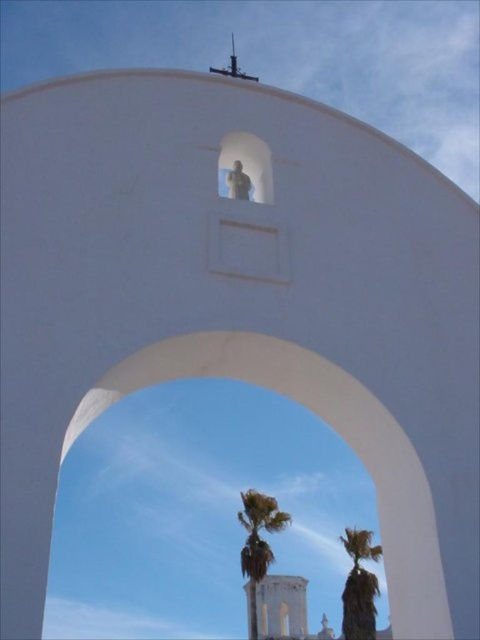
What do you see at coordinates (257, 541) in the screenshot? I see `green leafy palm at center` at bounding box center [257, 541].

Is green leafy palm at center positioned in front of green leafy palm tree at center?

Yes, green leafy palm at center is closer to the viewer.

The height and width of the screenshot is (640, 480). Describe the element at coordinates (257, 541) in the screenshot. I see `green leafy palm at center` at that location.

Identify the location of green leafy palm at center. (257, 541).